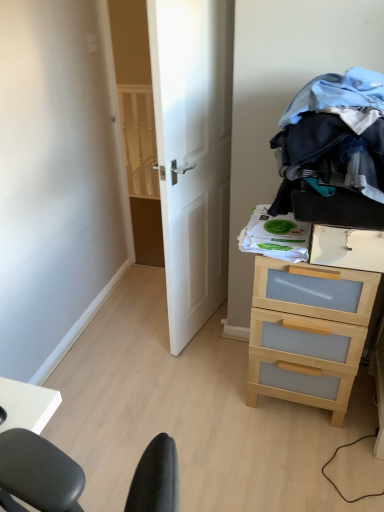
Question: Is white wooden door at center oriented away from light wood/ribbed drawer at right?

Choices:
 (A) yes
 (B) no

Answer: (A)

Question: Considering the relative positions of white wooden door at center and light wood/ribbed drawer at right in the image provided, is white wooden door at center to the right of light wood/ribbed drawer at right from the viewer's perspective?

Choices:
 (A) yes
 (B) no

Answer: (B)

Question: Is white wooden door at center positioned behind light wood/ribbed drawer at right?

Choices:
 (A) no
 (B) yes

Answer: (A)

Question: From a real-world perspective, does white wooden door at center sit lower than light wood/ribbed drawer at right?

Choices:
 (A) no
 (B) yes

Answer: (A)

Question: Is white wooden door at center completely or partially outside of light wood/ribbed drawer at right?

Choices:
 (A) yes
 (B) no

Answer: (A)

Question: Is white wooden door at center bigger than light wood/ribbed drawer at right?

Choices:
 (A) yes
 (B) no

Answer: (A)

Question: Does white wooden door at center have a lesser height compared to denim fabric clothes at upper right?

Choices:
 (A) yes
 (B) no

Answer: (B)

Question: Considering the relative sizes of white wooden door at center and denim fabric clothes at upper right in the image provided, is white wooden door at center taller than denim fabric clothes at upper right?

Choices:
 (A) no
 (B) yes

Answer: (B)

Question: Is white wooden door at center wider than denim fabric clothes at upper right?

Choices:
 (A) yes
 (B) no

Answer: (B)

Question: Is white wooden door at center not within denim fabric clothes at upper right?

Choices:
 (A) no
 (B) yes

Answer: (B)

Question: Considering the relative positions of white wooden door at center and denim fabric clothes at upper right in the image provided, is white wooden door at center behind denim fabric clothes at upper right?

Choices:
 (A) yes
 (B) no

Answer: (A)

Question: Are white wooden door at center and denim fabric clothes at upper right located far from each other?

Choices:
 (A) yes
 (B) no

Answer: (B)

Question: Does denim fabric clothes at upper right have a smaller size compared to white wooden door at center?

Choices:
 (A) yes
 (B) no

Answer: (A)